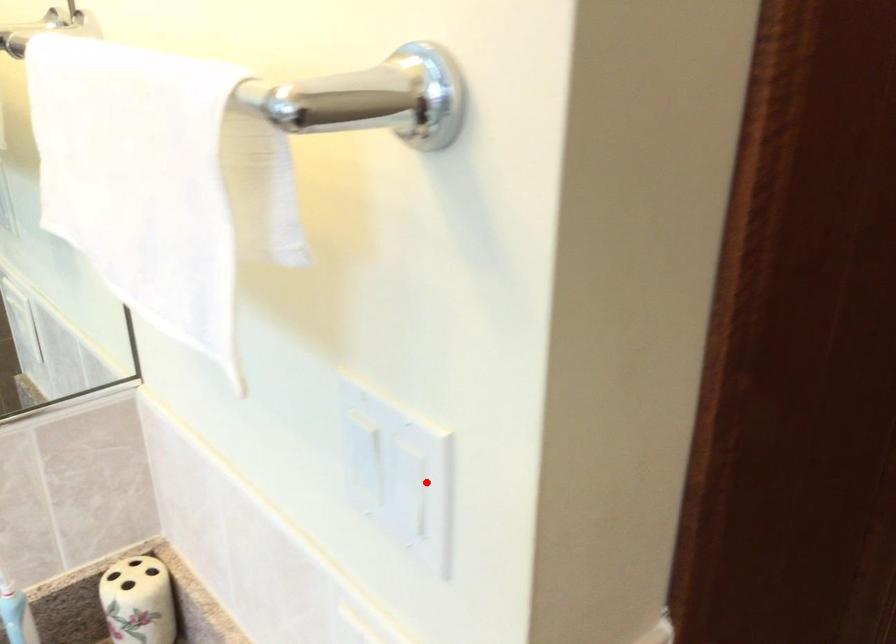
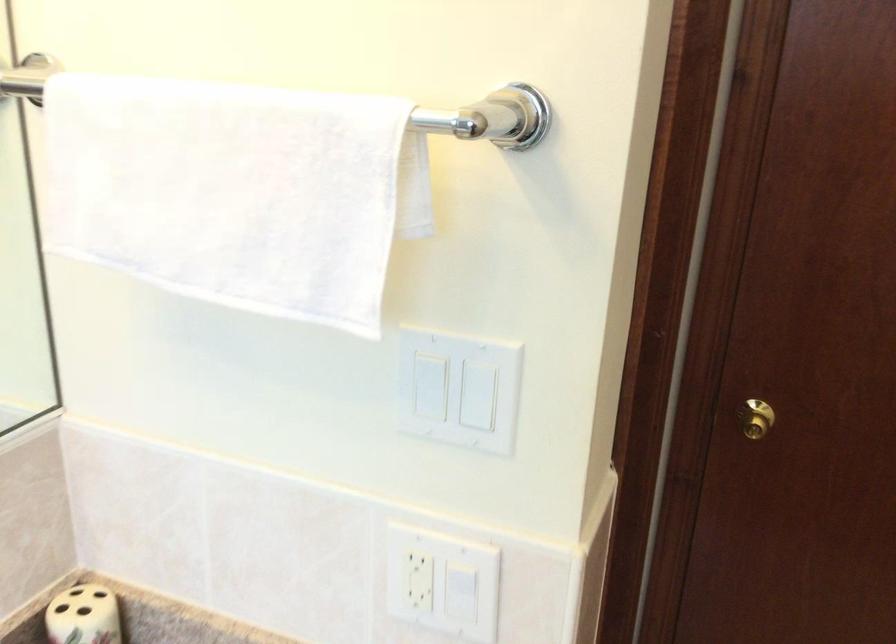
Find the pixel in the second image that matches the highlighted location in the first image.

(483, 395)